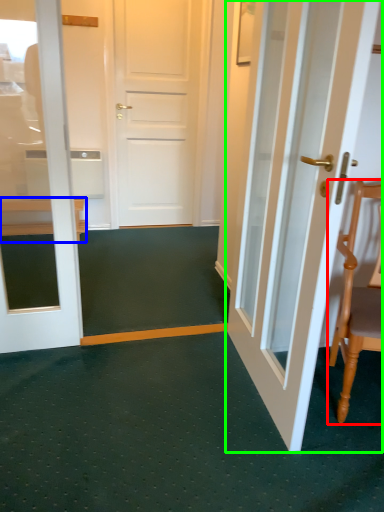
Question: Which is farther away from chair (highlighted by a red box)? furniture (highlighted by a blue box) or door (highlighted by a green box)?

Choices:
 (A) furniture
 (B) door

Answer: (A)